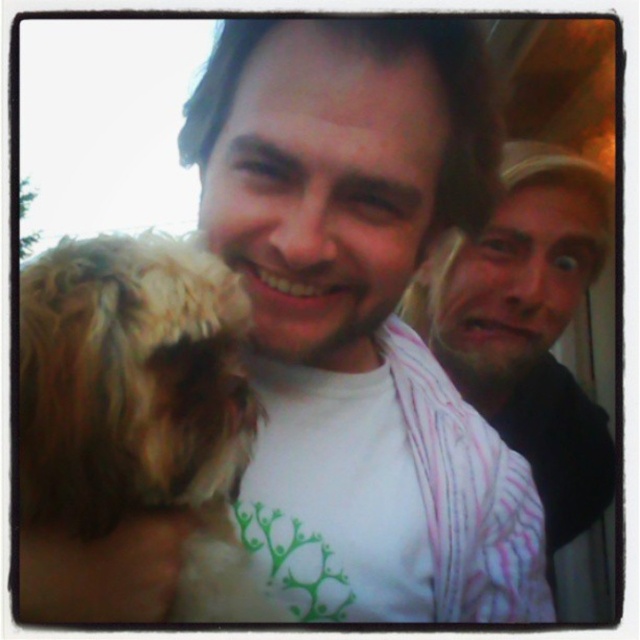
You are a photographer trying to capture a candid shot of the pink striped shirt at right and the fuzzy brown dog at left. Based on their positions, which subject is closer to the camera?

The fuzzy brown dog at left is closer to the camera because it is located below the pink striped shirt at right, indicating it is in a lower and more forward position.

You are standing at point (566, 589) and want to move to point (58, 316). Is the path clear of any obstacles between these two points?

Yes, the path between point (58, 316) and point (566, 589) is clear since point (58, 316) is in front of point (566, 589), indicating no obstruction between them.